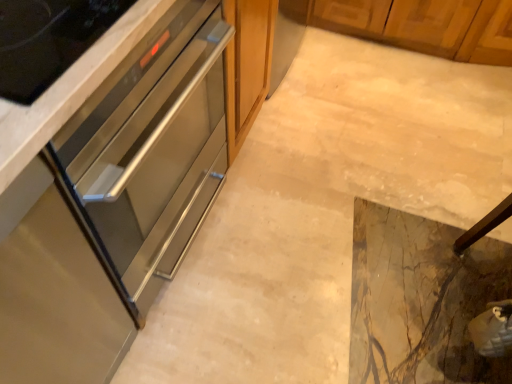
Question: Based on their sizes in the image, would you say stainless steel drawer at left, the 3th cabinetry from the top, is bigger or smaller than stainless steel oven at center, acting as the 3th cabinetry starting from the bottom?

Choices:
 (A) big
 (B) small

Answer: (A)

Question: From the image's perspective, is stainless steel drawer at left, positioned as the first cabinetry in bottom-to-top order, positioned above or below stainless steel oven at center, acting as the 3th cabinetry starting from the bottom?

Choices:
 (A) above
 (B) below

Answer: (B)

Question: Estimate the real-world distances between objects in this image. Which object is farther from the stainless steel oven at left, positioned as the 2th cabinetry in top-to-bottom order?

Choices:
 (A) stainless steel drawer at left, positioned as the first cabinetry in bottom-to-top order
 (B) stainless steel oven at center, the 1th cabinetry positioned from the top
 (C) marble tile floor at center

Answer: (C)

Question: Which object is the closest to the marble tile floor at center?

Choices:
 (A) stainless steel oven at center, the 1th cabinetry positioned from the top
 (B) stainless steel oven at left, positioned as the 2th cabinetry in top-to-bottom order
 (C) stainless steel drawer at left, positioned as the first cabinetry in bottom-to-top order

Answer: (B)